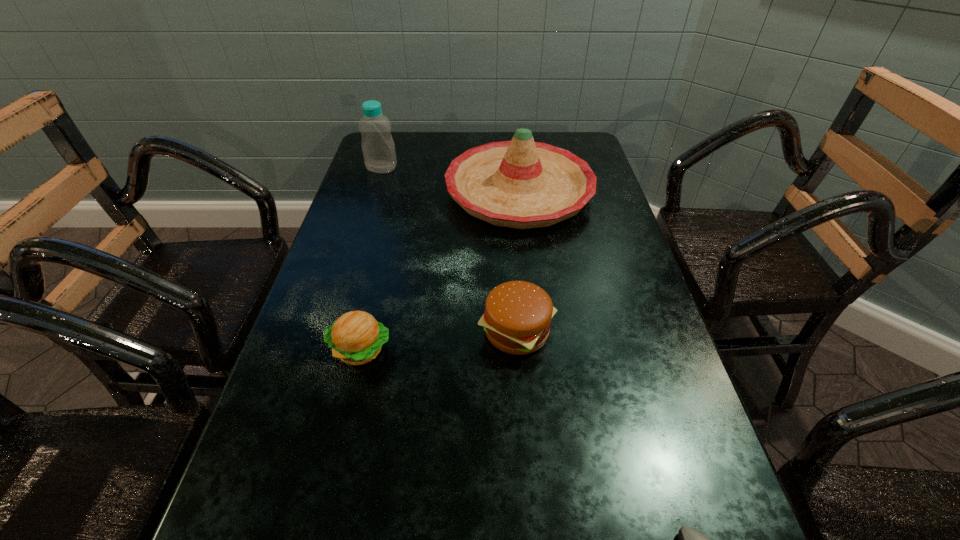
This screenshot has width=960, height=540. I want to click on bottle, so click(x=378, y=147).

At what (x,y) coordinates should I click in order to perform the action: click on sombrero. Please return your answer as a coordinate pair (x, y). This screenshot has width=960, height=540. Looking at the image, I should click on (522, 184).

Identify the location of the right hamburger. The image size is (960, 540). (517, 318).

Identify the location of the left hamburger. This screenshot has width=960, height=540. (356, 338).

The width and height of the screenshot is (960, 540). What are the coordinates of `free location located 0.100m on the right of the bottle` in the screenshot? It's located at (430, 168).

You are a GUI agent. You are given a task and a screenshot of the screen. Output one action in this format:
    pyautogui.click(x=<x>, y=<y>)
    Task: Click on the vacant space located on the left of the sombrero
    Image resolution: width=960 pixels, height=540 pixels.
    Given the screenshot: What is the action you would take?
    pyautogui.click(x=407, y=192)

Image resolution: width=960 pixels, height=540 pixels. What are the coordinates of `blank space located on the left of the right hamburger` in the screenshot? It's located at (374, 332).

This screenshot has height=540, width=960. Find the location of `vacant point located on the front of the left hamburger`. vacant point located on the front of the left hamburger is located at coordinates (316, 537).

At what (x,y) coordinates should I click in order to perform the action: click on bottle at the far edge. Please return your answer as a coordinate pair (x, y). The width and height of the screenshot is (960, 540). Looking at the image, I should click on [378, 147].

In order to click on sombrero that is at the far edge in this screenshot , I will do coord(522,184).